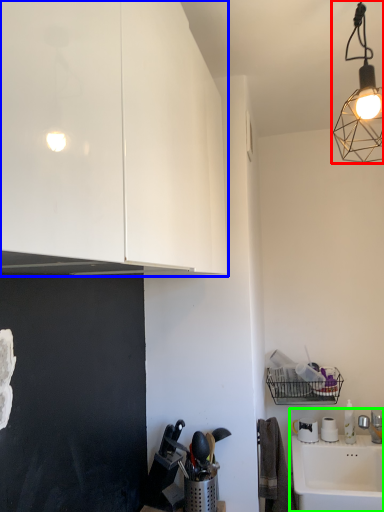
Question: Considering the real-world distances, which object is closest to lamp (highlighted by a red box)? cabinetry (highlighted by a blue box) or sink (highlighted by a green box).

Choices:
 (A) cabinetry
 (B) sink

Answer: (A)